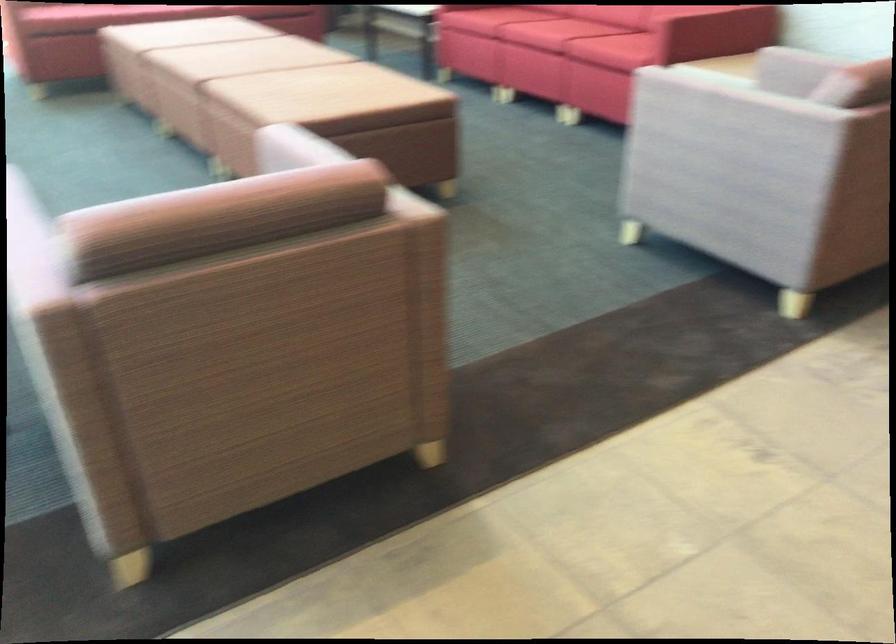
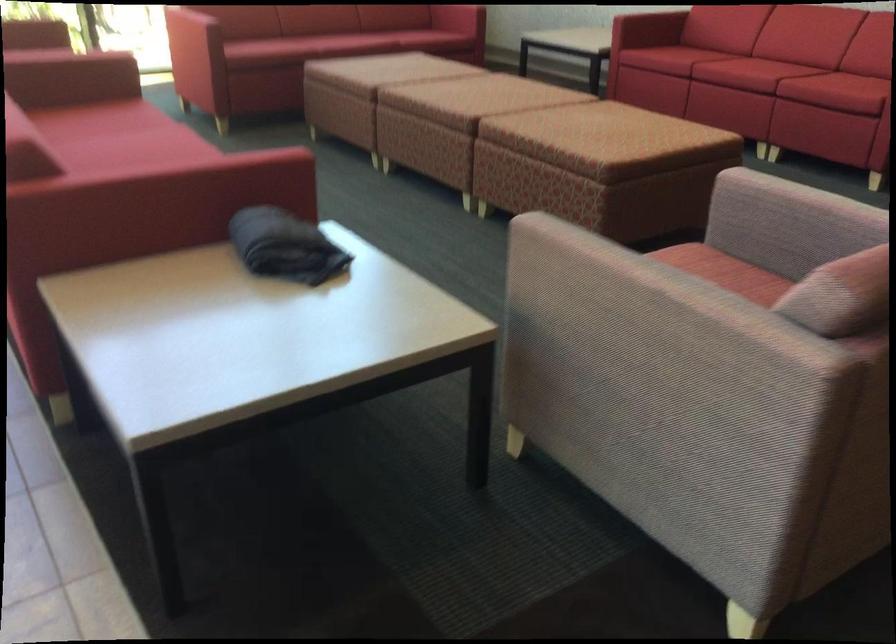
Question: In a continuous first-person perspective shot, in which direction is the camera moving?

Choices:
 (A) Left
 (B) Right
 (C) Forward
 (D) Backward

Answer: (D)